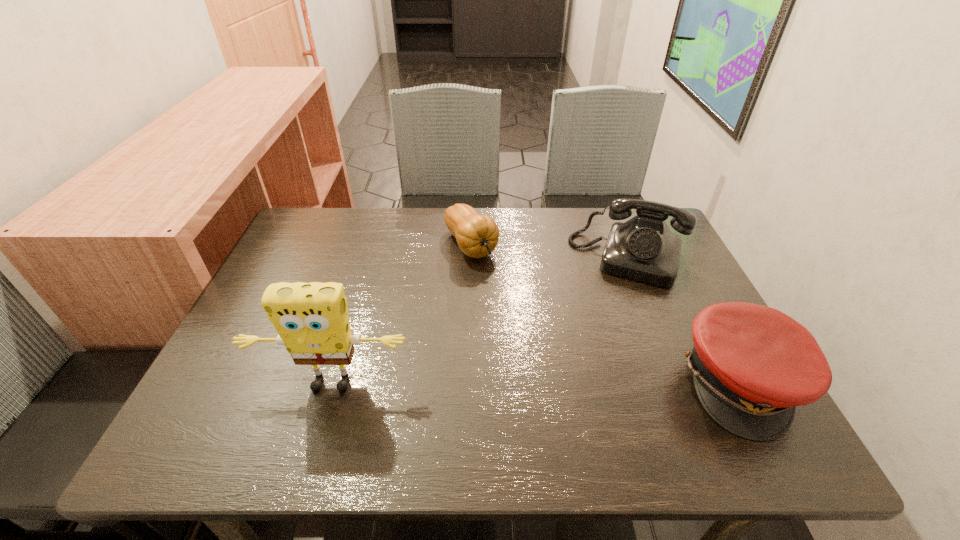
Find the location of `vacant space that is in between the second object from left to right and the sponge`. vacant space that is in between the second object from left to right and the sponge is located at coordinates pos(400,315).

I want to click on unoccupied position between the second object from left to right and the leftmost object, so click(x=400, y=315).

Find the location of a particular element. The width and height of the screenshot is (960, 540). free space between the third shortest object and the leftmost object is located at coordinates (479, 322).

Where is `vacant area that lies between the third shortest object and the second object from left to right`? The width and height of the screenshot is (960, 540). vacant area that lies between the third shortest object and the second object from left to right is located at coordinates (549, 252).

Where is `free point between the cap and the leftmost object`? The height and width of the screenshot is (540, 960). free point between the cap and the leftmost object is located at coordinates (536, 384).

Identify the location of free space that is in between the leftmost object and the cap. (536, 384).

Identify which object is the second nearest to the telephone. Please provide its 2D coordinates. Your answer should be formatted as a tuple, i.e. [(x, y)], where the tuple contains the x and y coordinates of a point satisfying the conditions above.

[(477, 235)]

Identify the location of object that is the third closest to the gourd. (752, 365).